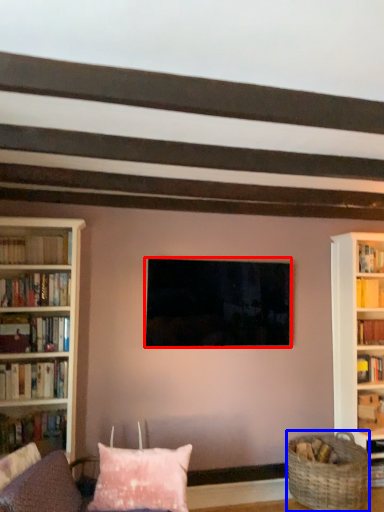
Question: Which object appears closest to the camera in this image, television (highlighted by a red box) or basket (highlighted by a blue box)?

Choices:
 (A) television
 (B) basket

Answer: (B)